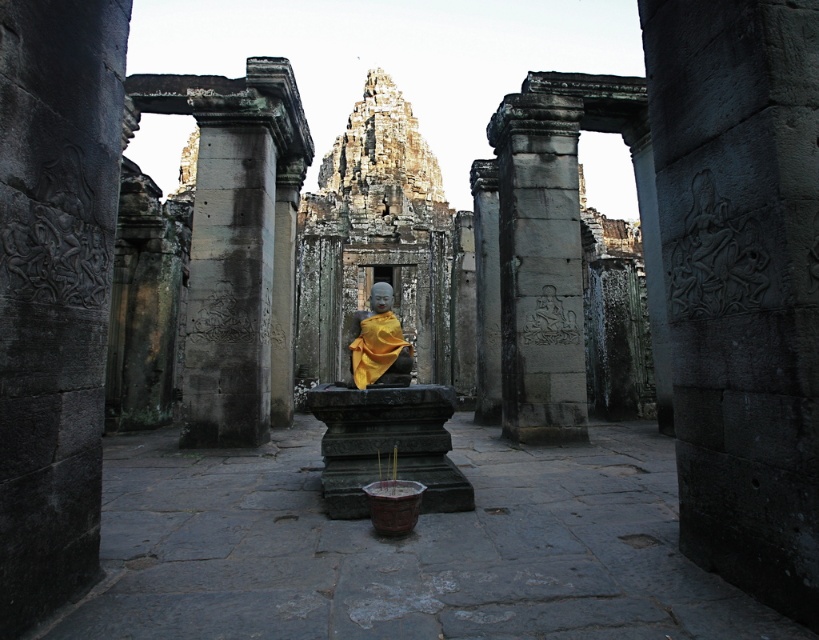
You are an archaeologist examining the ancient temple complex. You notice the gray stone pillar at center and the yellow fabric statue at center. According to the spatial arrangement, which object is positioned lower in the image?

The gray stone pillar at center is below the yellow fabric statue at center, so it is positioned lower in the image.

You are an archaeologist examining the ancient temple complex. You notice the gray stone carving at center and the gray stone pillar at center. Which object is taller?

The gray stone carving at center is taller than the gray stone pillar at center.